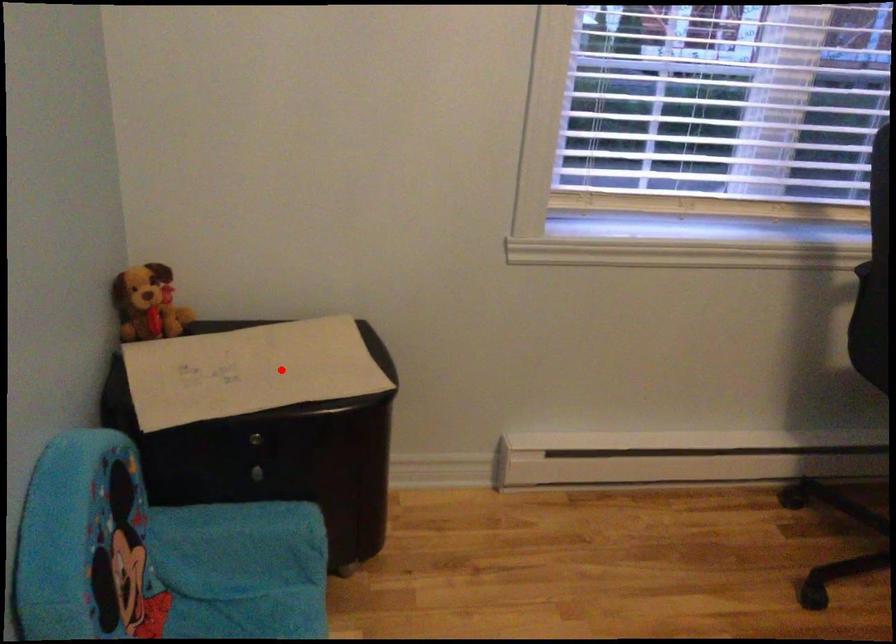
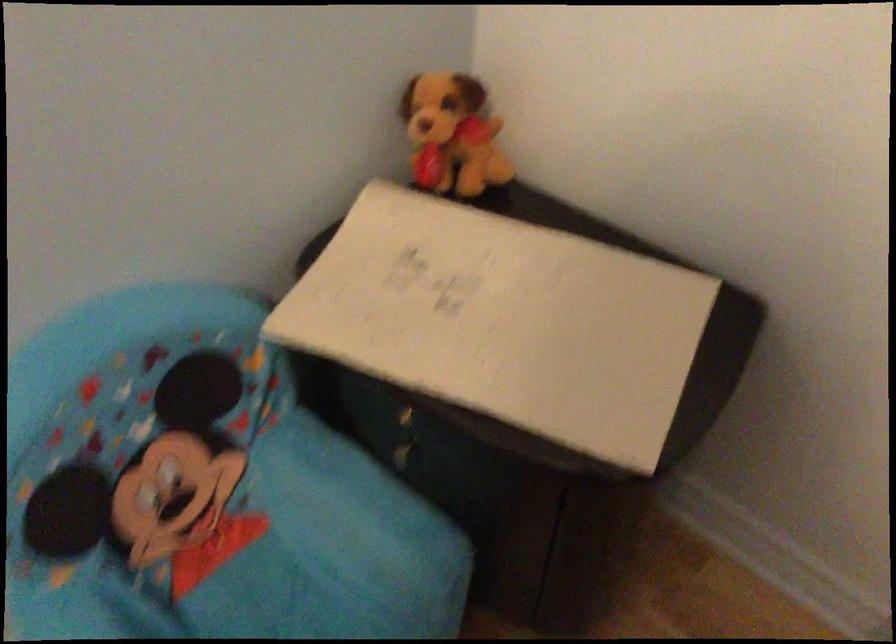
Question: I am providing you with two images of the same scene from different viewpoints. Given a red point in image1, look at the same physical point in image2. Is it:

Choices:
 (A) Closer to the viewpoint
 (B) Farther from the viewpoint

Answer: (A)